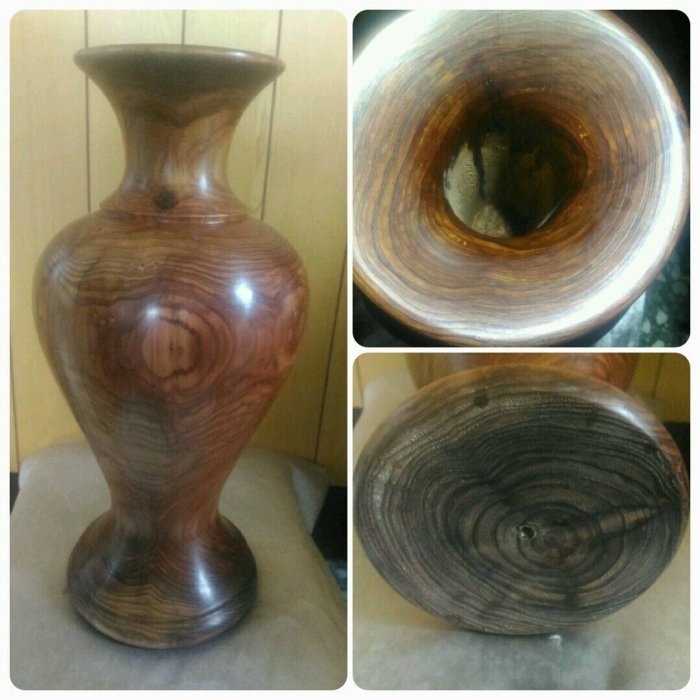
Where is `light glare on pot`? This screenshot has width=700, height=700. light glare on pot is located at coordinates pos(246,295), pos(211,186), pos(161,302), pos(197,594).